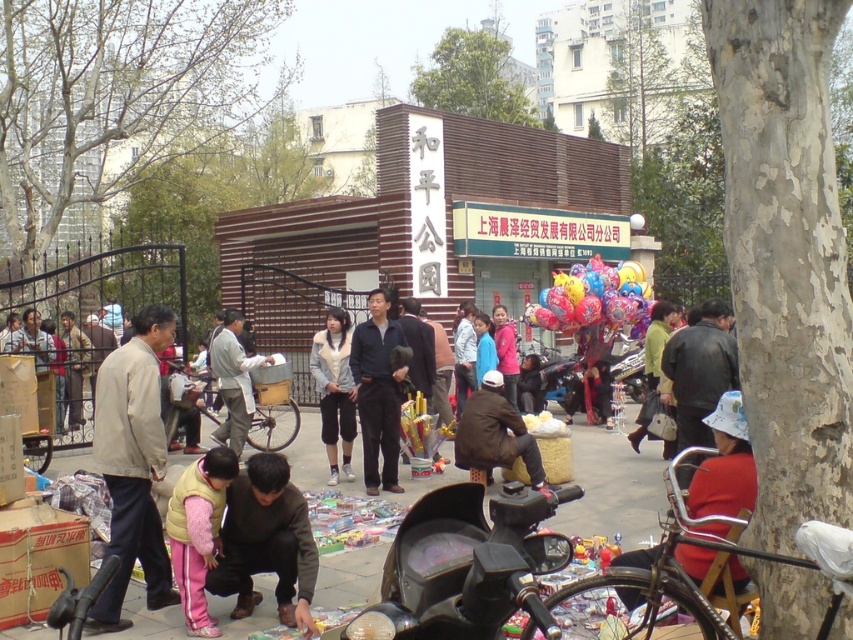
Question: Observing the image, what is the correct spatial positioning of glossy plastic balloons at center in reference to white fleece jacket at center?

Choices:
 (A) below
 (B) above

Answer: (B)

Question: Among these points, which one is nearest to the camera?

Choices:
 (A) (213, 582)
 (B) (328, 330)
 (C) (236, 378)

Answer: (A)

Question: Among these points, which one is nearest to the camera?

Choices:
 (A) (345, 376)
 (B) (231, 426)
 (C) (389, 371)
 (D) (209, 628)

Answer: (D)

Question: Is pink fleece vest at lower center behind white fleece jacket at center?

Choices:
 (A) no
 (B) yes

Answer: (A)

Question: Based on their relative distances, which object is farther from the dark blue fleece jacket at center?

Choices:
 (A) pink fleece vest at lower center
 (B) white fleece jacket at center
 (C) dark gray fabric jacket at lower center
 (D) glossy plastic balloons at center

Answer: (D)

Question: Does dark blue fleece jacket at center have a lesser width compared to light gray fabric jacket at center?

Choices:
 (A) no
 (B) yes

Answer: (B)